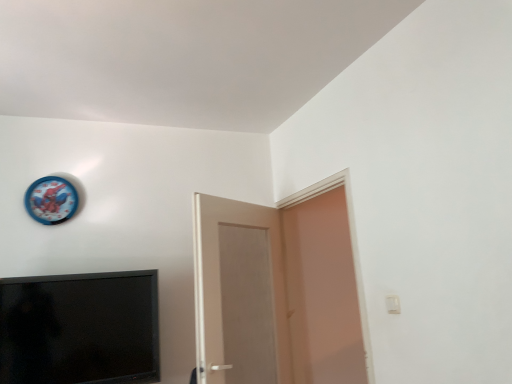
Question: From the image's perspective, is matte white door at right, which ranks as the 2th door in left-to-right order, on white matte door at center, which is the first door from left to right?

Choices:
 (A) yes
 (B) no

Answer: (A)

Question: Considering the relative sizes of matte white door at right, arranged as the first door when viewed from the right, and white matte door at center, the 2th door viewed from the right, in the image provided, is matte white door at right, arranged as the first door when viewed from the right, bigger than white matte door at center, the 2th door viewed from the right,?

Choices:
 (A) yes
 (B) no

Answer: (B)

Question: Does matte white door at right, arranged as the first door when viewed from the right, have a lesser height compared to white matte door at center, which is the first door from left to right?

Choices:
 (A) no
 (B) yes

Answer: (A)

Question: Is matte white door at right, arranged as the first door when viewed from the right, facing away from white matte door at center, which is the first door from left to right?

Choices:
 (A) yes
 (B) no

Answer: (A)

Question: Could you tell me if matte white door at right, arranged as the first door when viewed from the right, is facing white matte door at center, which is the first door from left to right?

Choices:
 (A) no
 (B) yes

Answer: (B)

Question: Considering their positions, is black matte television at lower left located in front of or behind blue plastic clock at upper left?

Choices:
 (A) front
 (B) behind

Answer: (A)

Question: From the image's perspective, is black matte television at lower left positioned above or below blue plastic clock at upper left?

Choices:
 (A) below
 (B) above

Answer: (A)

Question: Is point (113, 377) closer or farther from the camera than point (44, 198)?

Choices:
 (A) farther
 (B) closer

Answer: (B)

Question: Choose the correct answer: Is black matte television at lower left inside blue plastic clock at upper left or outside it?

Choices:
 (A) inside
 (B) outside

Answer: (B)

Question: From their relative heights in the image, would you say blue plastic clock at upper left is taller or shorter than matte white door at right, arranged as the first door when viewed from the right?

Choices:
 (A) tall
 (B) short

Answer: (B)

Question: Considering the positions of blue plastic clock at upper left and matte white door at right, which ranks as the 2th door in left-to-right order, in the image, is blue plastic clock at upper left wider or thinner than matte white door at right, which ranks as the 2th door in left-to-right order,?

Choices:
 (A) wide
 (B) thin

Answer: (B)

Question: From a real-world perspective, is blue plastic clock at upper left physically located above or below matte white door at right, which ranks as the 2th door in left-to-right order?

Choices:
 (A) above
 (B) below

Answer: (A)

Question: Is blue plastic clock at upper left in front of or behind matte white door at right, which ranks as the 2th door in left-to-right order, in the image?

Choices:
 (A) front
 (B) behind

Answer: (B)

Question: Do you think matte white door at right, which ranks as the 2th door in left-to-right order, is within blue plastic clock at upper left, or outside of it?

Choices:
 (A) inside
 (B) outside

Answer: (B)

Question: From the image's perspective, is matte white door at right, which ranks as the 2th door in left-to-right order, positioned above or below blue plastic clock at upper left?

Choices:
 (A) above
 (B) below

Answer: (B)